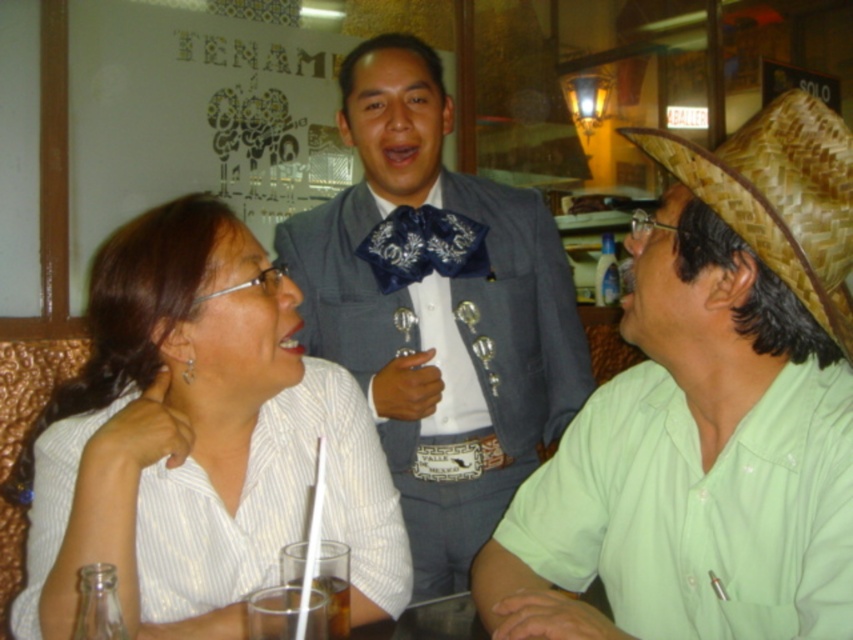
Question: Does matte gray suit at center appear under dark blue satin bow tie at center?

Choices:
 (A) no
 (B) yes

Answer: (B)

Question: Among these points, which one is nearest to the camera?

Choices:
 (A) (x=569, y=452)
 (B) (x=326, y=573)
 (C) (x=827, y=154)
 (D) (x=218, y=280)

Answer: (B)

Question: Does white glossy shirt at upper left come in front of translucent glass at table center?

Choices:
 (A) yes
 (B) no

Answer: (B)

Question: Which object is the farthest from the translucent glass at table center?

Choices:
 (A) white glossy shirt at upper left
 (B) woven straw cowboy hat at right
 (C) matte gray suit at center

Answer: (C)

Question: Based on their relative distances, which object is nearer to the matte gray suit at center?

Choices:
 (A) translucent glass at table center
 (B) green straw hat at right

Answer: (B)

Question: Can you confirm if matte gray suit at center is positioned above translucent glass at table center?

Choices:
 (A) yes
 (B) no

Answer: (A)